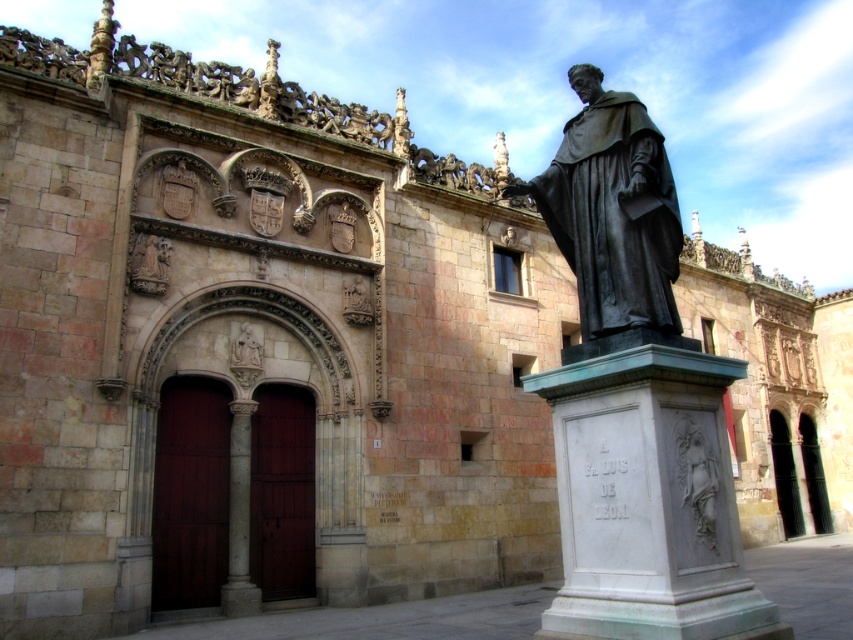
You are standing in front of the historical building and see a point marked at coordinates (614, 216). What object does this point correspond to?

The point corresponds to the bronze statue at right.